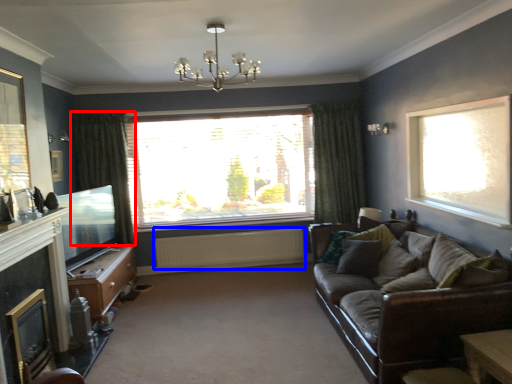
Question: Which object is further to the camera taking this photo, curtain (highlighted by a red box) or radiator (highlighted by a blue box)?

Choices:
 (A) curtain
 (B) radiator

Answer: (B)